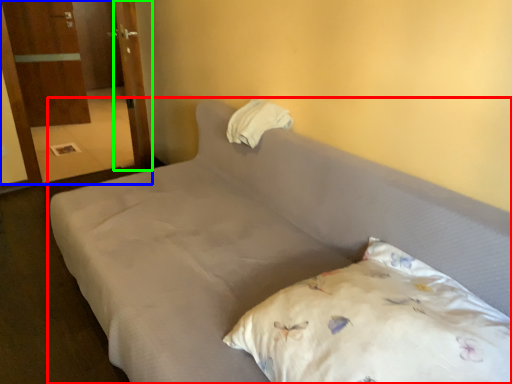
Question: Estimate the real-world distances between objects in this image. Which object is farther from bed (highlighted by a red box), armoire (highlighted by a blue box) or door (highlighted by a green box)?

Choices:
 (A) armoire
 (B) door

Answer: (A)